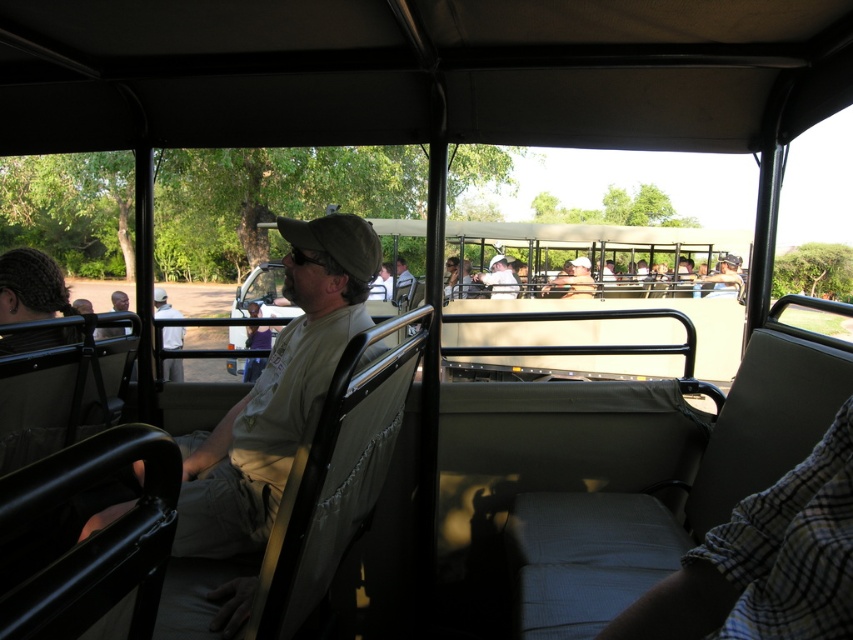
Does light brown leather jacket at center have a larger size compared to matte khaki shirt at center?

Indeed, light brown leather jacket at center has a larger size compared to matte khaki shirt at center.

Is point (166, 380) in front of point (491, 291)?

That is True.

At what (x,y) coordinates should I click in order to perform the action: click on light brown leather jacket at center. Please return your answer as a coordinate pair (x, y). Image resolution: width=853 pixels, height=640 pixels. Looking at the image, I should click on (163, 305).

Which is in front, point (270, 410) or point (165, 305)?

Positioned in front is point (270, 410).

Who is shorter, khaki fabric shirt at center or light brown leather jacket at center?

khaki fabric shirt at center

Which is behind, point (317, 275) or point (160, 314)?

Point (160, 314)

Locate an element on the screen. khaki fabric shirt at center is located at coordinates (276, 392).

Where is `khaki fabric shirt at center`? khaki fabric shirt at center is located at coordinates (276, 392).

Who is more distant from viewer, (268,396) or (485,280)?

The point (485,280) is behind.

Does point (251, 538) lie behind point (514, 291)?

No, (251, 538) is in front of (514, 291).

The image size is (853, 640). Find the location of `khaki fabric shirt at center`. khaki fabric shirt at center is located at coordinates (276, 392).